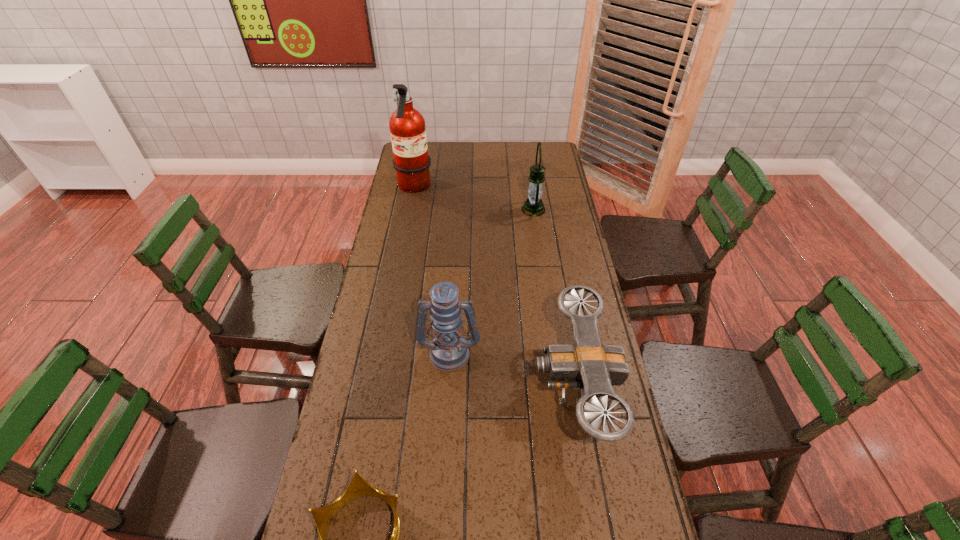
Find the location of a particular element. the tallest object is located at coordinates (407, 126).

Identify the location of the right lantern. (533, 206).

I want to click on the nearer lantern, so click(x=449, y=351).

Identify the location of drone. (588, 365).

Where is `vacant space located on the nozzle and handle of the tallest object`? This screenshot has width=960, height=540. vacant space located on the nozzle and handle of the tallest object is located at coordinates (472, 188).

The height and width of the screenshot is (540, 960). In order to click on vacant position located on the side where the right lantern emits light in this screenshot , I will do `click(493, 210)`.

In order to click on vacant region located 0.150m on the side where the right lantern emits light in this screenshot , I will do `click(486, 210)`.

I want to click on vacant area situated on the side where the right lantern emits light, so click(444, 210).

I want to click on vacant region located 0.300m on the front-facing side of the nearer lantern, so click(x=443, y=475).

Locate an element on the screen. This screenshot has width=960, height=540. vacant space situated 0.260m on the front-facing side of the fourth tallest object is located at coordinates (444, 387).